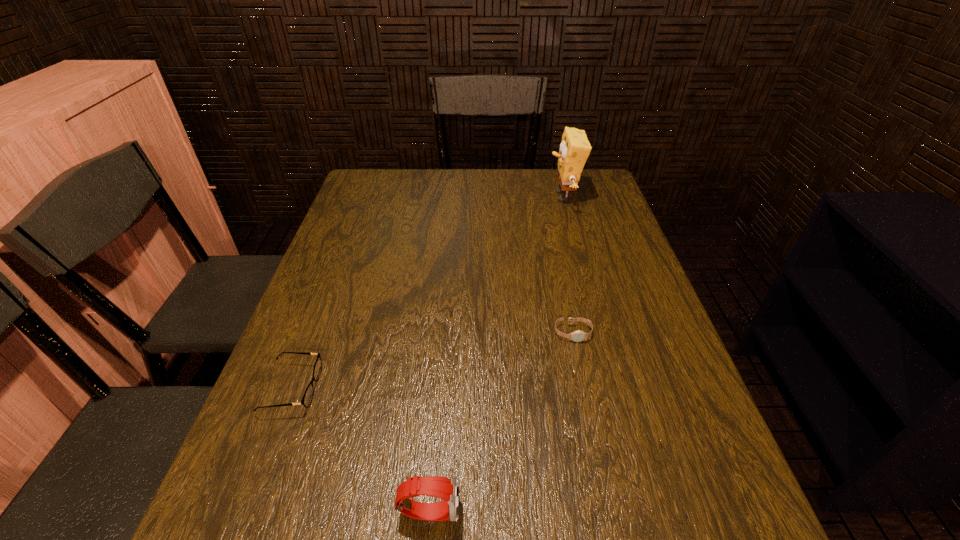
The width and height of the screenshot is (960, 540). What are the coordinates of `free space at the left edge of the desktop` in the screenshot? It's located at (x=377, y=214).

I want to click on free location at the right edge of the desktop, so click(x=635, y=422).

In the image, there is a desktop. Where is `free space at the far left corner`? free space at the far left corner is located at coordinates (389, 193).

At what (x,y) coordinates should I click in order to perform the action: click on vacant space that is in between the second nearest object and the farthest object. Please return your answer as a coordinate pair (x, y). The height and width of the screenshot is (540, 960). Looking at the image, I should click on (427, 293).

The height and width of the screenshot is (540, 960). Identify the location of vacant region between the sponge and the taller watch. (496, 354).

Identify the location of vacant point located between the sponge and the taller watch. The width and height of the screenshot is (960, 540). (496, 354).

The height and width of the screenshot is (540, 960). Identify the location of free spot between the shorter watch and the tallest object. (568, 265).

Locate an element on the screen. The height and width of the screenshot is (540, 960). free spot between the second tallest object and the farthest object is located at coordinates (496, 354).

Find the location of a particular element. vacant space that is in between the third farthest object and the shorter watch is located at coordinates (432, 361).

You are a GUI agent. You are given a task and a screenshot of the screen. Output one action in this format:
    pyautogui.click(x=<x>, y=<y>)
    Task: Click on the free space between the third nearest object and the third farthest object
    
    Given the screenshot: What is the action you would take?
    pyautogui.click(x=432, y=361)